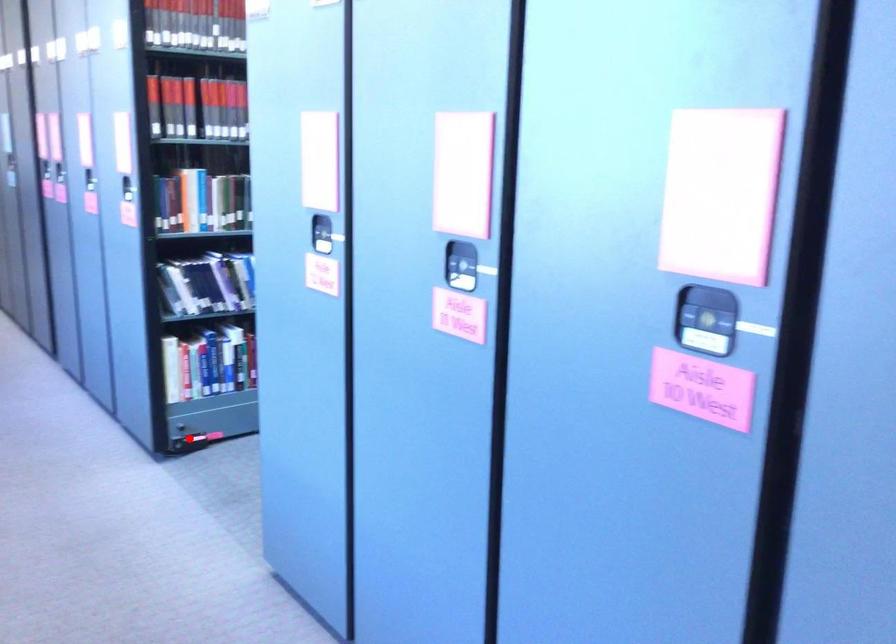
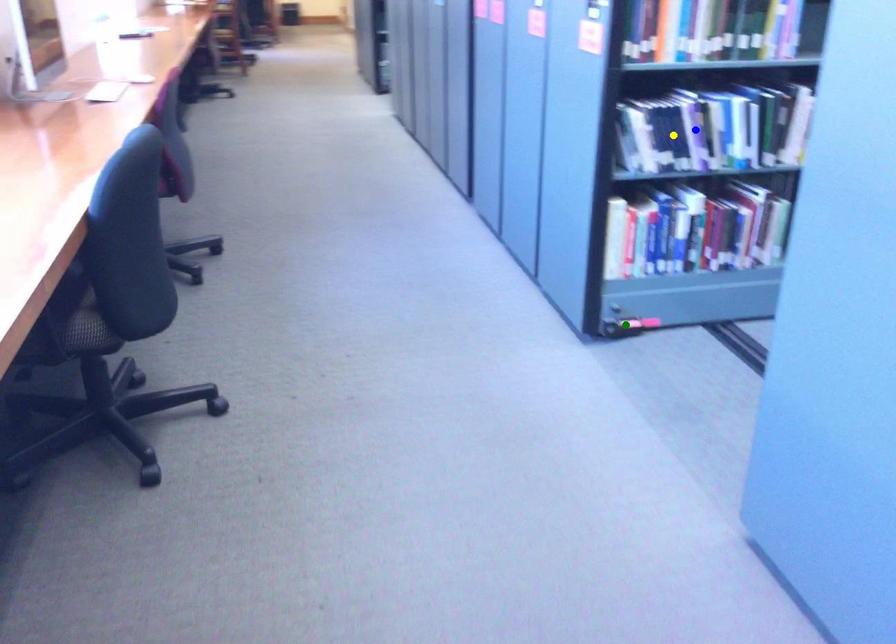
Question: I am providing you with two images of the same scene from different viewpoints. A red point is marked on the first image. You are given multiple points on the second image. Which point in image 2 is actually the same real-world point as the red point in image 1?

Choices:
 (A) blue point
 (B) yellow point
 (C) green point

Answer: (C)